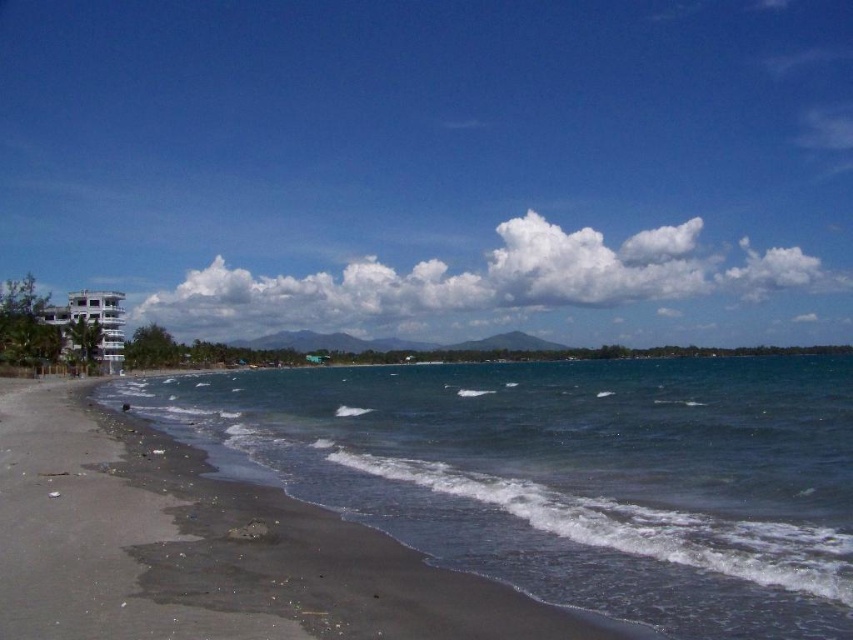
Question: Which point appears farthest from the camera in this image?

Choices:
 (A) (654, 280)
 (B) (102, 342)

Answer: (A)

Question: Which of the following is the closest to the observer?

Choices:
 (A) (332, 442)
 (B) (77, 310)

Answer: (A)

Question: Is dark blue water at lower left wider than white glossy building at left?

Choices:
 (A) no
 (B) yes

Answer: (B)

Question: Observing the image, what is the correct spatial positioning of dark blue water at lower left in reference to white fluffy cloud at upper center?

Choices:
 (A) left
 (B) right

Answer: (A)

Question: Does dark blue water at lower left appear on the left side of white fluffy cloud at upper center?

Choices:
 (A) no
 (B) yes

Answer: (B)

Question: Which point appears closest to the camera in this image?

Choices:
 (A) [x=112, y=371]
 (B) [x=442, y=289]
 (C) [x=645, y=522]

Answer: (C)